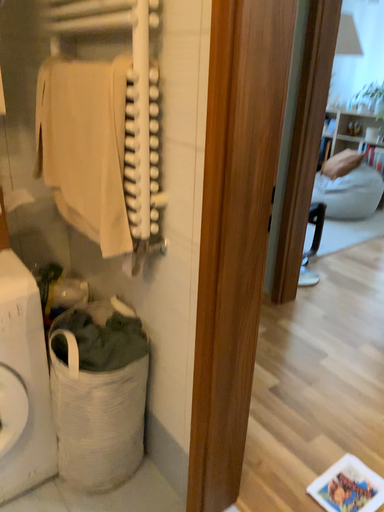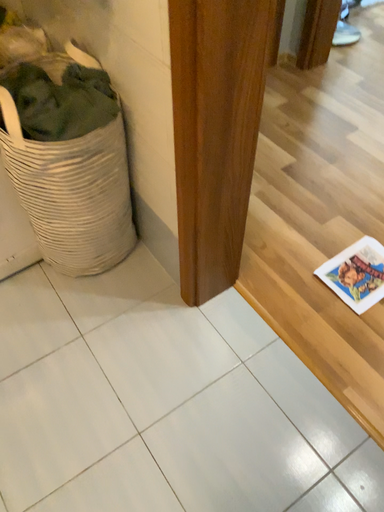
Question: How did the camera likely rotate when shooting the video?

Choices:
 (A) rotated upward
 (B) rotated downward

Answer: (B)